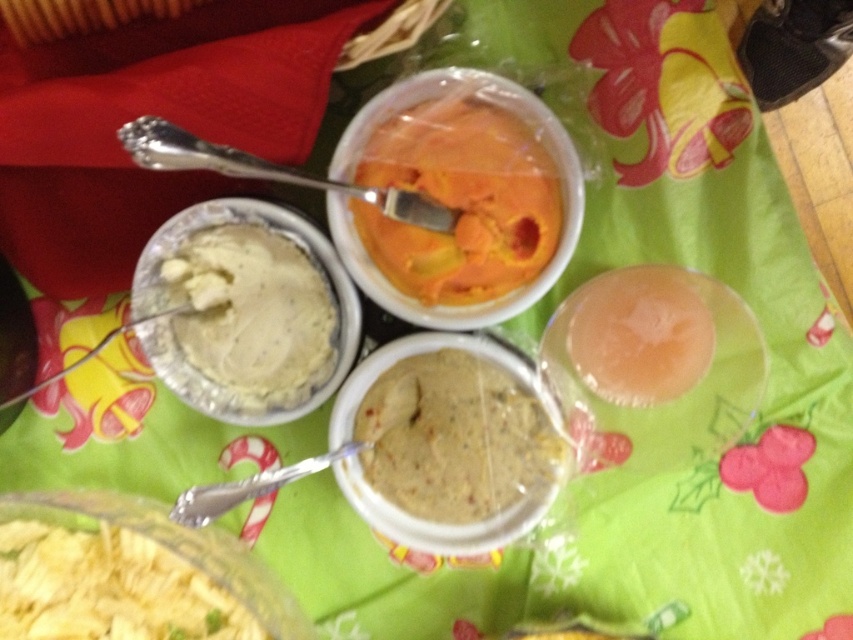
Between white creamy paste at center and translucent plastic cup at center, which one has more height?

white creamy paste at center is taller.

Can you confirm if white creamy paste at center is bigger than translucent plastic cup at center?

Correct, white creamy paste at center is larger in size than translucent plastic cup at center.

Where is `white creamy paste at center`? This screenshot has height=640, width=853. white creamy paste at center is located at coordinates (252, 316).

This screenshot has width=853, height=640. Identify the location of white creamy paste at center. (252, 316).

This screenshot has width=853, height=640. Describe the element at coordinates (252, 316) in the screenshot. I see `white creamy paste at center` at that location.

Who is shorter, white creamy paste at center or yellow crumbly cheese at lower left?

yellow crumbly cheese at lower left is shorter.

This screenshot has width=853, height=640. Describe the element at coordinates (252, 316) in the screenshot. I see `white creamy paste at center` at that location.

The height and width of the screenshot is (640, 853). Find the location of `white creamy paste at center`. white creamy paste at center is located at coordinates pyautogui.click(x=252, y=316).

Measure the distance between orange matte ice cream at center and yellow crumbly cheese at lower left.

orange matte ice cream at center is 32.63 centimeters away from yellow crumbly cheese at lower left.

How far apart are orange matte ice cream at center and yellow crumbly cheese at lower left?

They are 12.85 inches apart.

Is point (454, 202) positioned behind point (161, 609)?

Yes.

The image size is (853, 640). I want to click on orange matte ice cream at center, so click(x=461, y=202).